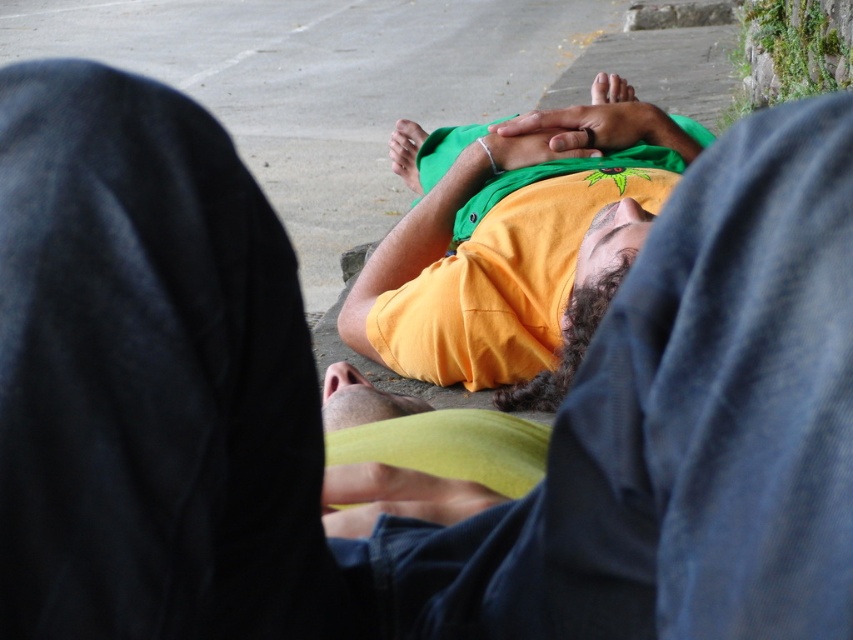
Question: Does matte yellow t-shirt at center have a larger size compared to matte yellow head at center?

Choices:
 (A) yes
 (B) no

Answer: (A)

Question: Which object appears closest to the camera in this image?

Choices:
 (A) matte yellow t-shirt at center
 (B) matte yellow head at center

Answer: (B)

Question: Is matte yellow t-shirt at center below matte yellow head at center?

Choices:
 (A) no
 (B) yes

Answer: (A)

Question: Is matte yellow t-shirt at center above matte yellow head at center?

Choices:
 (A) yes
 (B) no

Answer: (A)